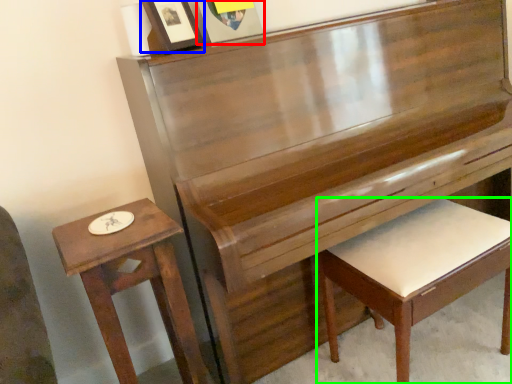
Question: Estimate the real-world distances between objects in this image. Which object is closer to picture frame (highlighted by a red box), picture frame (highlighted by a blue box) or furniture (highlighted by a green box)?

Choices:
 (A) picture frame
 (B) furniture

Answer: (A)